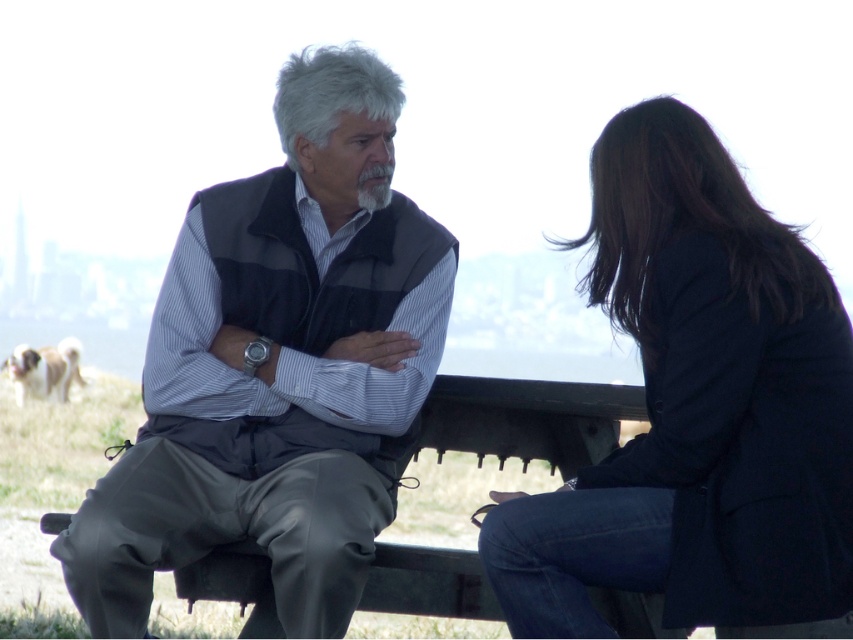
Question: Which point is closer to the camera?

Choices:
 (A) dark blue blazer at right
 (B) fluffy beige dog at lower left

Answer: (A)

Question: Which of the following is the closest to the observer?

Choices:
 (A) (498, 564)
 (B) (49, 380)
 (C) (213, 499)

Answer: (A)

Question: Does gray fabric vest at center appear on the left side of dark blue blazer at right?

Choices:
 (A) no
 (B) yes

Answer: (B)

Question: Which point appears closest to the camera in this image?

Choices:
 (A) (19, 388)
 (B) (213, 330)
 (C) (798, 598)

Answer: (C)

Question: From the image, what is the correct spatial relationship of gray fabric vest at center in relation to fluffy beige dog at lower left?

Choices:
 (A) left
 (B) right

Answer: (B)

Question: Considering the relative positions of dark blue blazer at right and fluffy beige dog at lower left in the image provided, where is dark blue blazer at right located with respect to fluffy beige dog at lower left?

Choices:
 (A) above
 (B) below

Answer: (A)